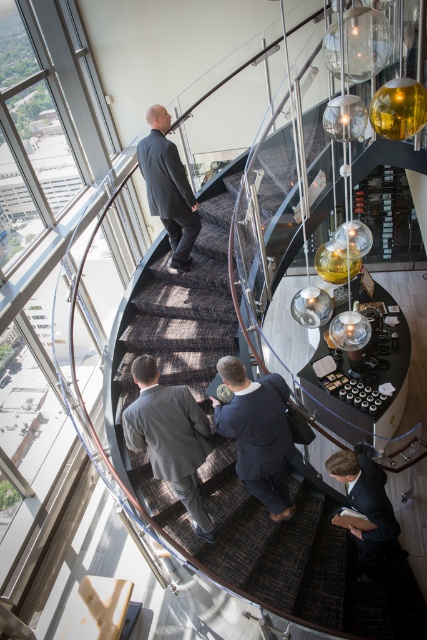
Question: Is dark gray suit at center above dark blue suit at center?

Choices:
 (A) no
 (B) yes

Answer: (A)

Question: Can you confirm if dark blue suit at center is smaller than dark gray suit at lower right?

Choices:
 (A) yes
 (B) no

Answer: (A)

Question: Which of these objects is positioned farthest from the dark gray suit at upper center?

Choices:
 (A) dark gray suit at center
 (B) brown carpeted stairs at center
 (C) dark blue suit at center

Answer: (C)

Question: Does brown carpeted stairs at center have a smaller size compared to dark gray suit at upper center?

Choices:
 (A) yes
 (B) no

Answer: (B)

Question: Among these objects, which one is farthest from the camera?

Choices:
 (A) dark blue suit at center
 (B) dark gray suit at center
 (C) brown carpeted stairs at center
 (D) dark gray suit at upper center

Answer: (D)

Question: Which object appears closest to the camera in this image?

Choices:
 (A) dark gray suit at center
 (B) dark gray suit at lower right
 (C) brown carpeted stairs at center

Answer: (A)